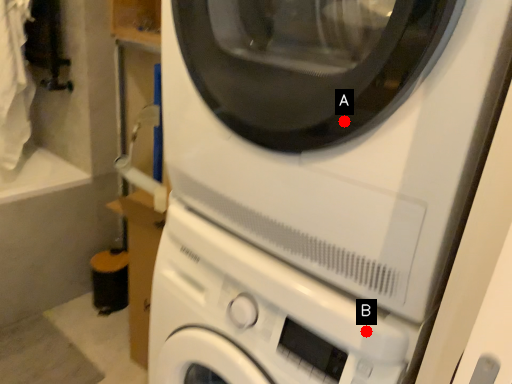
Question: Two points are circled on the image, labeled by A and B beside each circle. Which point is closer to the camera taking this photo?

Choices:
 (A) A is closer
 (B) B is closer

Answer: (A)